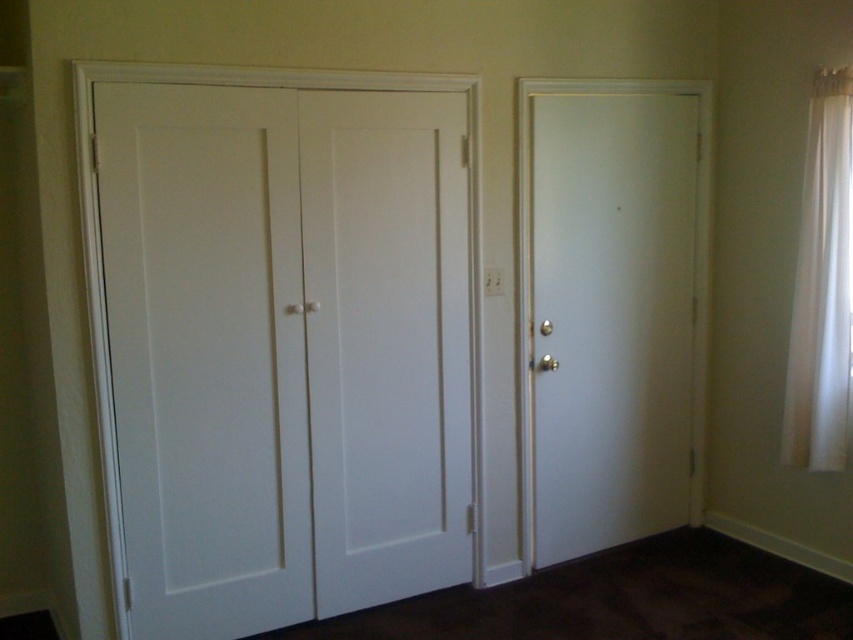
Question: Which point is farther to the camera?

Choices:
 (A) white smooth door at right
 (B) white sheer curtain at right
 (C) white smooth door at center

Answer: (A)

Question: Can you confirm if white matte door at left is positioned below white smooth door at center?

Choices:
 (A) yes
 (B) no

Answer: (A)

Question: Which point is closer to the camera?

Choices:
 (A) (807, 435)
 (B) (396, 556)

Answer: (B)

Question: From the image, what is the correct spatial relationship of white smooth door at center in relation to white smooth door at right?

Choices:
 (A) left
 (B) right

Answer: (A)

Question: Considering the real-world distances, which object is closest to the white matte door at left?

Choices:
 (A) white sheer curtain at right
 (B) white smooth door at center
 (C) white smooth door at right

Answer: (B)

Question: Is white matte door at left further to camera compared to white smooth door at right?

Choices:
 (A) yes
 (B) no

Answer: (B)